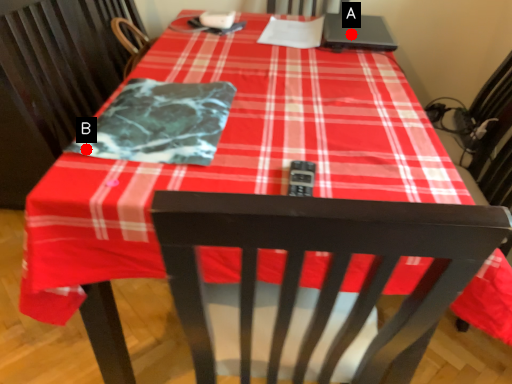
Question: Two points are circled on the image, labeled by A and B beside each circle. Which point is farther from the camera taking this photo?

Choices:
 (A) A is further
 (B) B is further

Answer: (A)